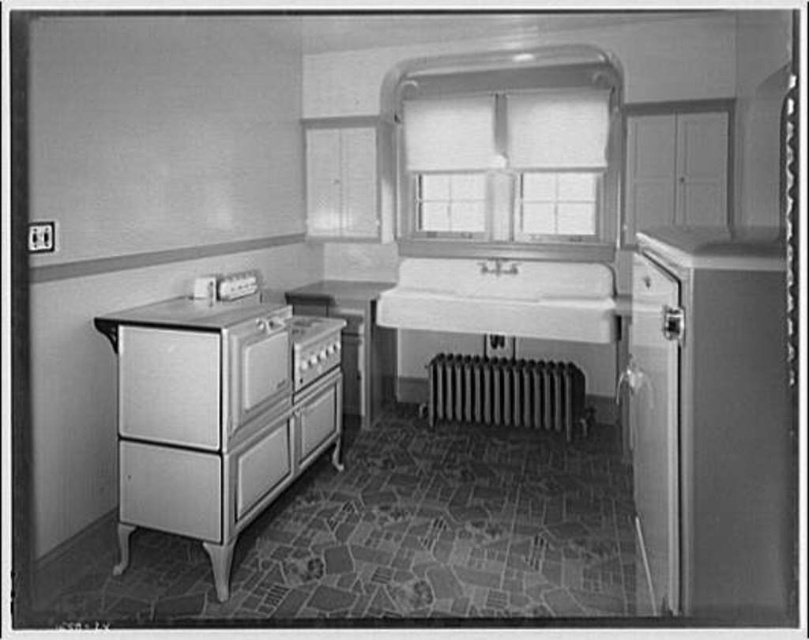
Question: Considering the real-world distances, which object is closest to the white textured window at center?

Choices:
 (A) metallic silver drawer at lower right
 (B) white porcelain sink at center

Answer: (B)

Question: Is white textured window at center to the left of white glossy drawer at lower left from the viewer's perspective?

Choices:
 (A) no
 (B) yes

Answer: (A)

Question: Which point is closer to the camera?

Choices:
 (A) (460, 282)
 (B) (311, 392)
 (C) (632, 262)

Answer: (B)

Question: Which object appears closest to the camera in this image?

Choices:
 (A) metallic silver radiator at center
 (B) metallic silver drawer at lower left
 (C) metallic silver drawer at lower right

Answer: (C)

Question: In this image, where is white porcelain sink at center located relative to white glossy drawer at lower left?

Choices:
 (A) below
 (B) above

Answer: (B)

Question: Is white glossy drawer at lower left further to camera compared to metallic silver drawer at lower left?

Choices:
 (A) yes
 (B) no

Answer: (B)